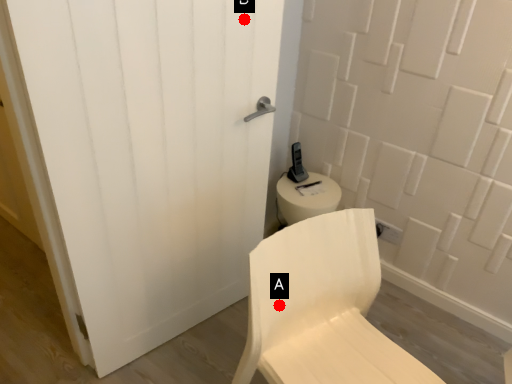
Question: Two points are circled on the image, labeled by A and B beside each circle. Which point is farther from the camera taking this photo?

Choices:
 (A) A is further
 (B) B is further

Answer: (B)